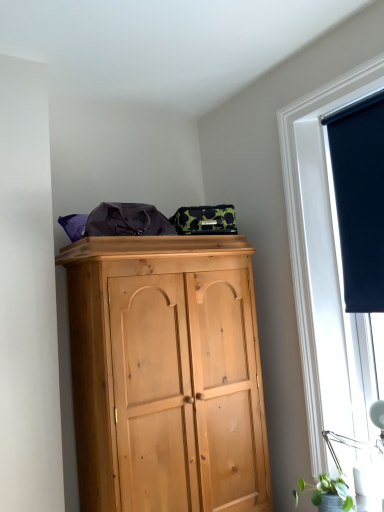
Question: From a real-world perspective, is matte black roller blind at right positioned above or below dark blue fabric at upper right?

Choices:
 (A) below
 (B) above

Answer: (A)

Question: From the image's perspective, relative to dark blue fabric at upper right, is matte black roller blind at right above or below?

Choices:
 (A) below
 (B) above

Answer: (A)

Question: Considering the real-world distances, which object is closest to the matte black roller blind at right?

Choices:
 (A) green matte plant at lower right
 (B) dark blue fabric at upper right

Answer: (B)

Question: Which object is the farthest from the dark blue fabric at upper right?

Choices:
 (A) green matte plant at lower right
 (B) matte black roller blind at right

Answer: (A)